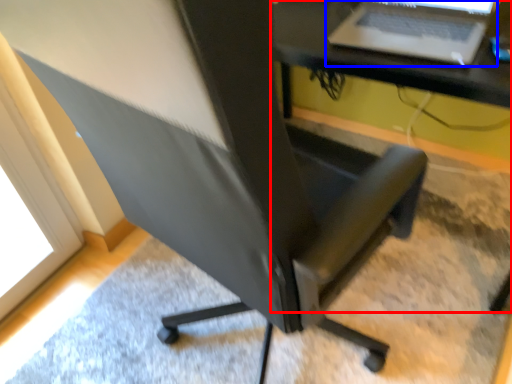
Question: Which object appears farthest to the camera in this image, computer desk (highlighted by a red box) or laptop (highlighted by a blue box)?

Choices:
 (A) computer desk
 (B) laptop

Answer: (B)